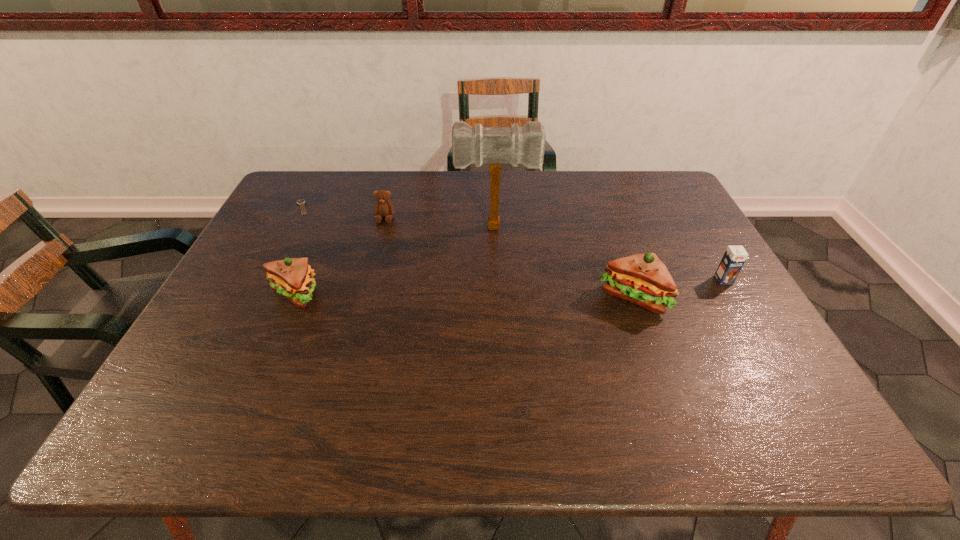
Image resolution: width=960 pixels, height=540 pixels. I want to click on the left sandwich, so click(292, 278).

The width and height of the screenshot is (960, 540). I want to click on the fifth shortest object, so click(x=642, y=279).

Locate an element on the screen. the second object from right to left is located at coordinates (642, 279).

At what (x,y) coordinates should I click in order to perform the action: click on the tallest object. Please return your answer as a coordinate pair (x, y). This screenshot has width=960, height=540. Looking at the image, I should click on (495, 145).

What are the coordinates of `mallet` in the screenshot? It's located at (495, 145).

Image resolution: width=960 pixels, height=540 pixels. I want to click on the fifth tallest object, so click(x=383, y=208).

Identify the location of teddy bear. The height and width of the screenshot is (540, 960). (383, 208).

Find the location of a particular element. watch is located at coordinates (301, 202).

Locate an element on the screen. Image resolution: width=960 pixels, height=540 pixels. the rightmost object is located at coordinates (734, 258).

At what (x,y) coordinates should I click in order to perform the action: click on vacant position located on the back of the left sandwich. Please return your answer as a coordinate pair (x, y). Image resolution: width=960 pixels, height=540 pixels. Looking at the image, I should click on (329, 213).